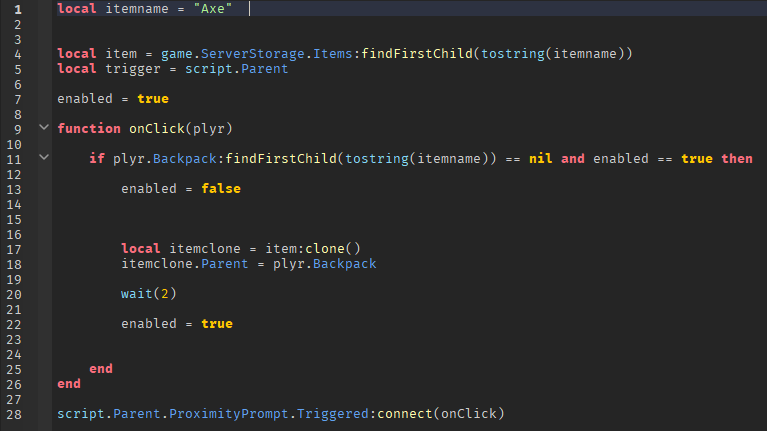
Find the location of a particular element. 1 black screen is located at coordinates (555, 244).